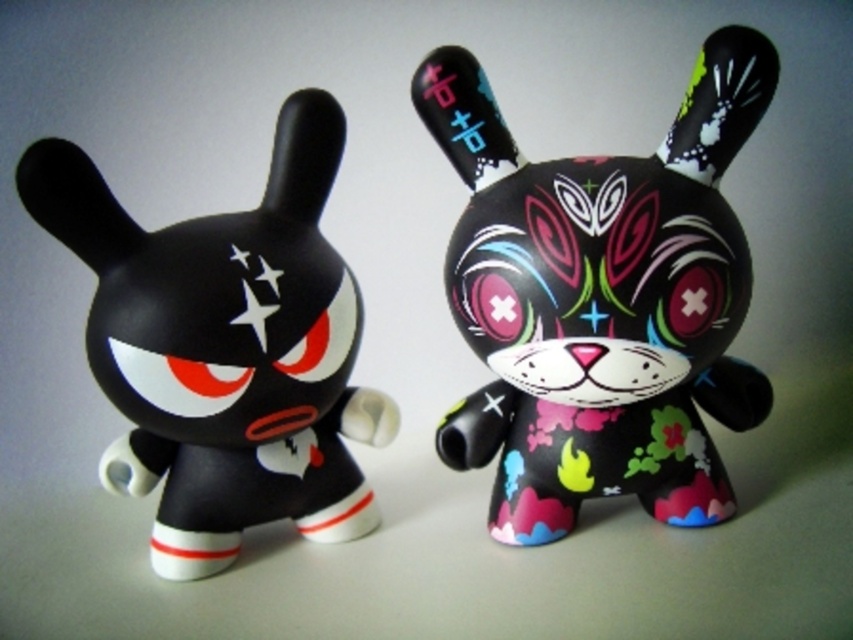
Question: Does matte black rabbit at center appear over matte black toy at left?

Choices:
 (A) yes
 (B) no

Answer: (A)

Question: Does matte black rabbit at center have a smaller size compared to matte black toy at left?

Choices:
 (A) no
 (B) yes

Answer: (B)

Question: Among these objects, which one is nearest to the camera?

Choices:
 (A) matte black toy at left
 (B) matte black rabbit at center

Answer: (A)

Question: Does matte black rabbit at center come in front of matte black toy at left?

Choices:
 (A) no
 (B) yes

Answer: (A)

Question: Which object appears closest to the camera in this image?

Choices:
 (A) matte black rabbit at center
 (B) matte black toy at left

Answer: (B)